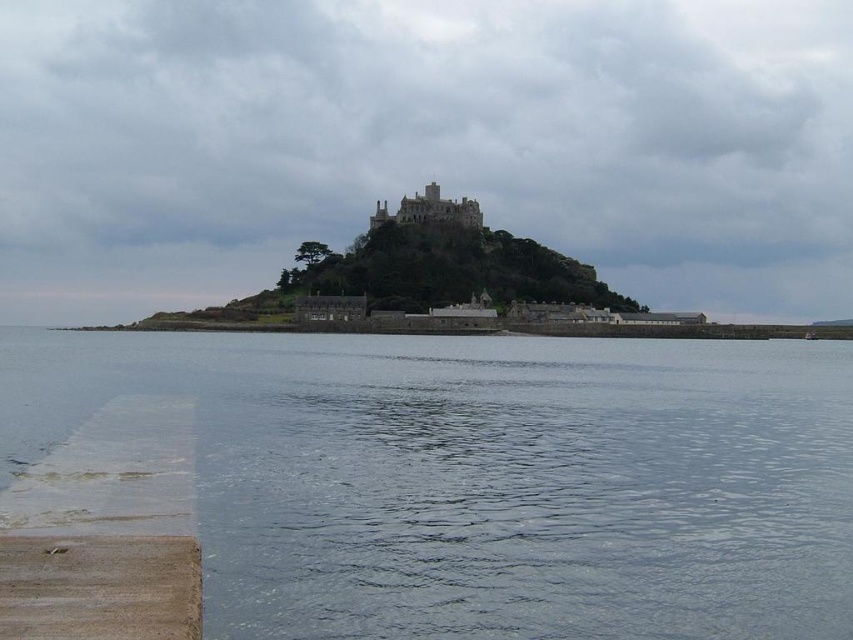
You are standing on the beach and see the clear water at lower left and the brown wooden dock at lower left. Which one is closer to you?

The clear water at lower left is closer to you because it is further to the viewer than the brown wooden dock at lower left.

You are standing on the brown wooden dock at lower left and want to see the clear water at lower left. In which direction should you look relative to the dock?

The clear water at lower left is positioned over the brown wooden dock at lower left, so you should look downward to see the clear water at lower left.